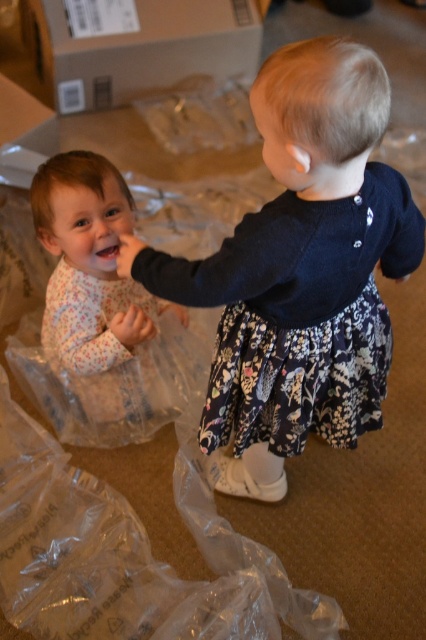
In the scene shown: Between floral dress at left and brown cardboard box at upper left, which one appears on the right side from the viewer's perspective?

Positioned to the right is floral dress at left.

Can you confirm if floral dress at left is shorter than brown cardboard box at upper left?

In fact, floral dress at left may be taller than brown cardboard box at upper left.

Which is behind, point (253, 234) or point (118, 97)?

The point (118, 97) is behind.

Identify the location of floral dress at left. (301, 269).

The image size is (426, 640). Describe the element at coordinates (301, 269) in the screenshot. I see `floral dress at left` at that location.

The height and width of the screenshot is (640, 426). I want to click on floral dress at left, so click(x=301, y=269).

The image size is (426, 640). I want to click on floral dress at left, so click(301, 269).

What are the coordinates of `floral dress at left` in the screenshot? It's located at (301, 269).

Between point (94, 358) and point (86, 99), which one is positioned in front?

Positioned in front is point (94, 358).

Does floral pajamas at left have a larger size compared to brown cardboard box at upper left?

Incorrect, floral pajamas at left is not larger than brown cardboard box at upper left.

Is point (112, 289) more distant than point (196, 72)?

No, it is not.

Identify the location of floral pajamas at left. (91, 266).